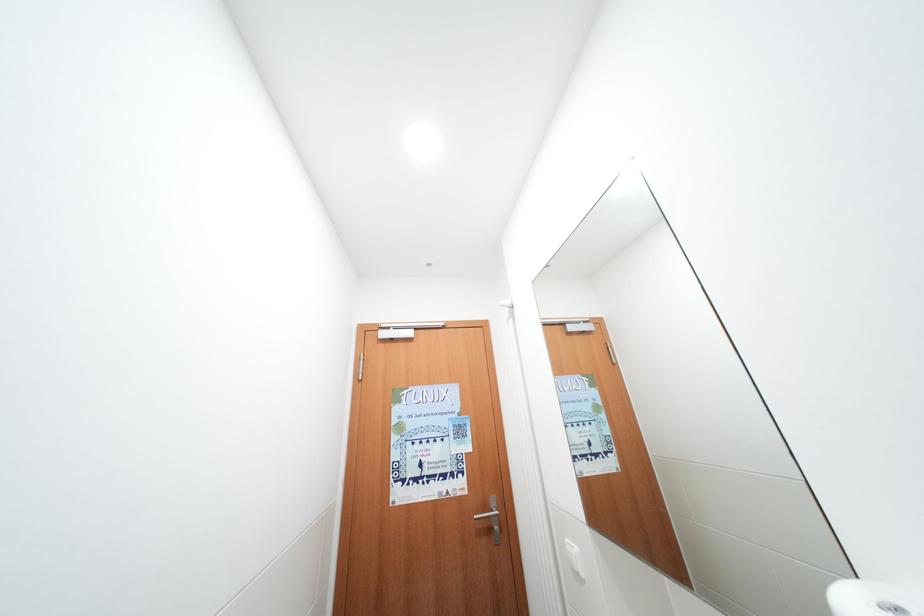
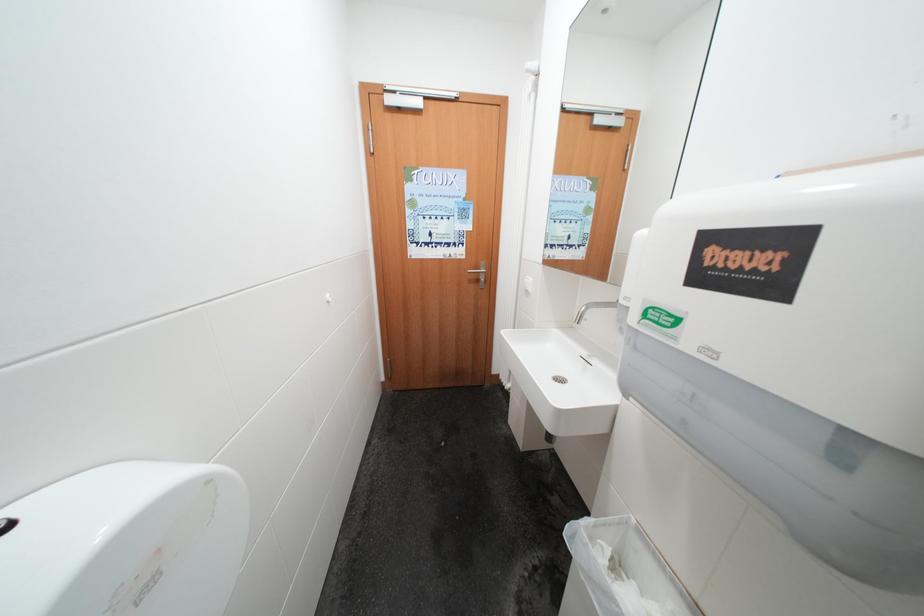
Question: How did the camera likely rotate?

Choices:
 (A) Left
 (B) Right
 (C) Up
 (D) Down

Answer: (D)